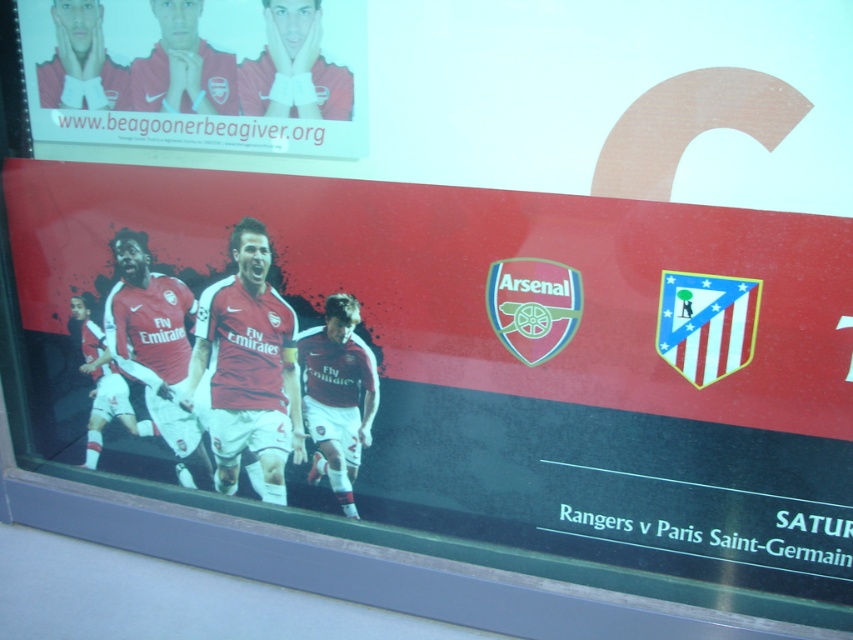
You are designing a new layout for the poster and want to ensure that both the matte red jersey at center and the matte red jersey at upper left are clearly visible. Based on their current positions, which jersey is positioned closer to the viewer?

Result: The matte red jersey at center is positioned closer to the viewer because it is in front of the matte red jersey at upper left.